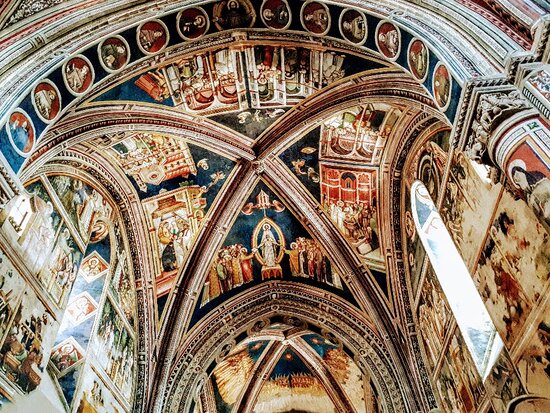
Where is `window`? The height and width of the screenshot is (413, 550). window is located at coordinates [444, 245], [79, 287].